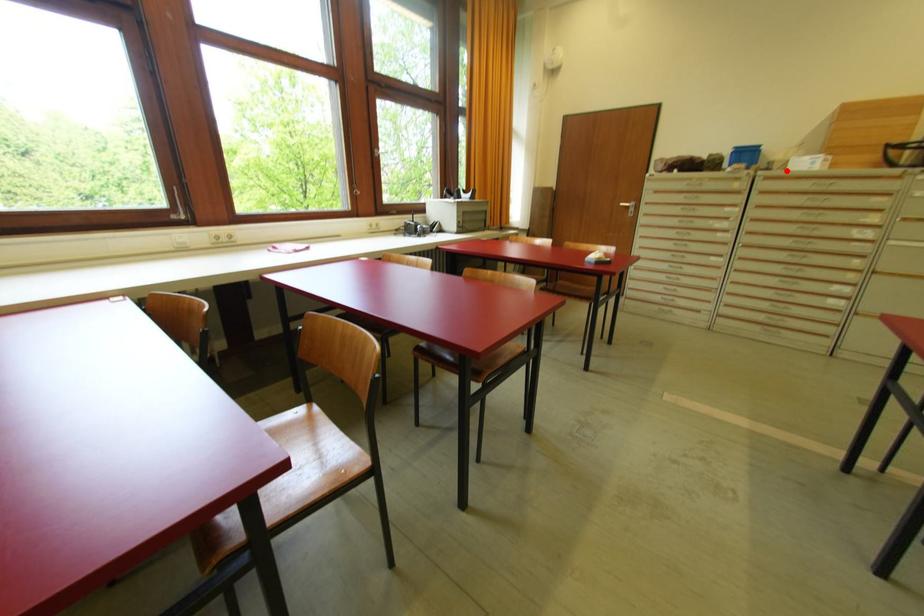
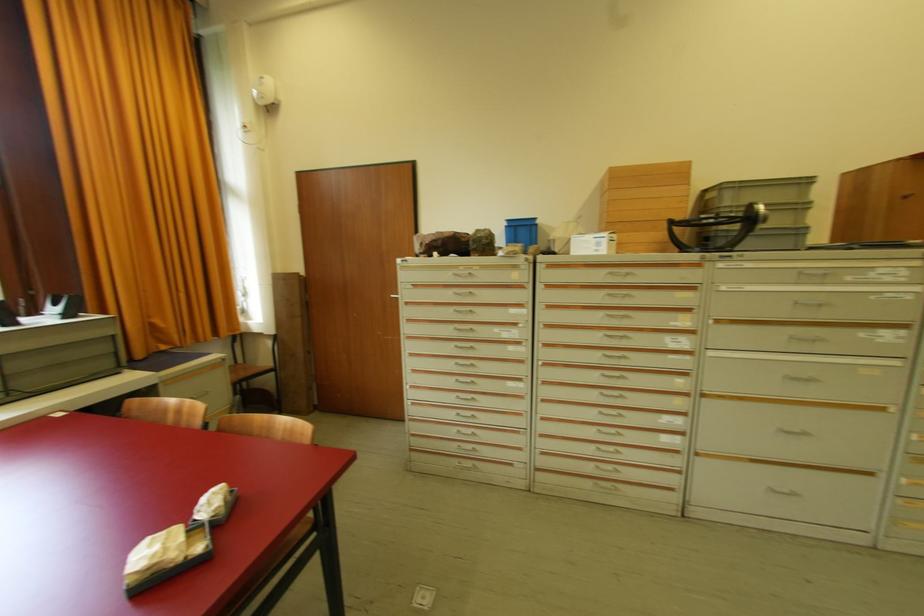
Find the pixel in the second image that matches the highlighted location in the first image.

(570, 254)